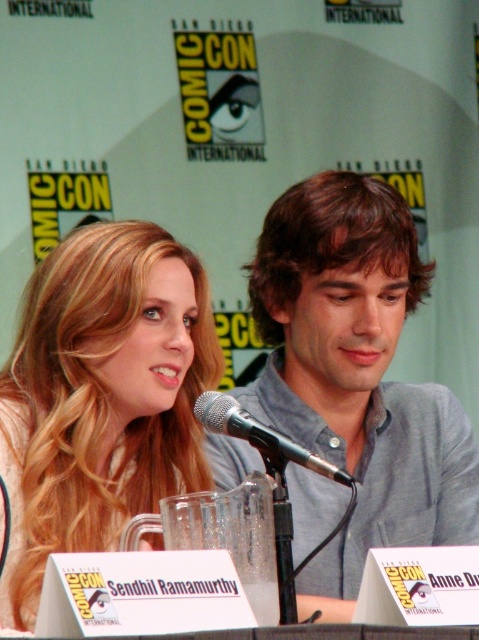
Question: Among these objects, which one is nearest to the camera?

Choices:
 (A) gray cotton shirt at center
 (B) blonde hair at upper left
 (C) silver metallic microphone at center

Answer: (C)

Question: Does blonde hair at upper left have a larger size compared to silver metallic microphone at center?

Choices:
 (A) no
 (B) yes

Answer: (B)

Question: Which point appears farthest from the camera in this image?

Choices:
 (A) (418, 468)
 (B) (99, 532)
 (C) (204, 420)

Answer: (A)

Question: Does blonde hair at upper left come in front of silver metallic microphone at center?

Choices:
 (A) yes
 (B) no

Answer: (B)

Question: Estimate the real-world distances between objects in this image. Which object is closer to the gray cotton shirt at center?

Choices:
 (A) silver metallic microphone at center
 (B) blonde hair at upper left

Answer: (B)

Question: Is gray cotton shirt at center above silver metallic microphone at center?

Choices:
 (A) no
 (B) yes

Answer: (B)